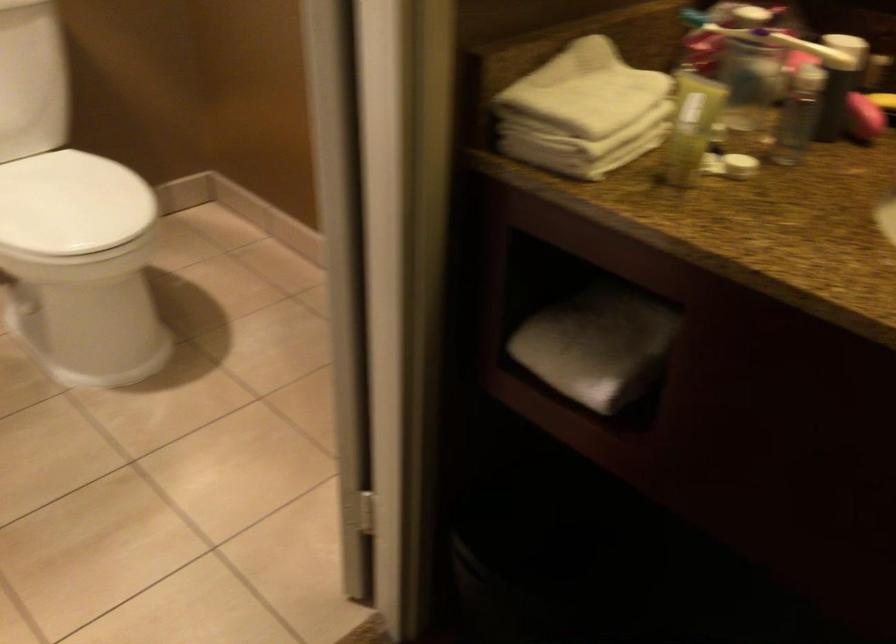
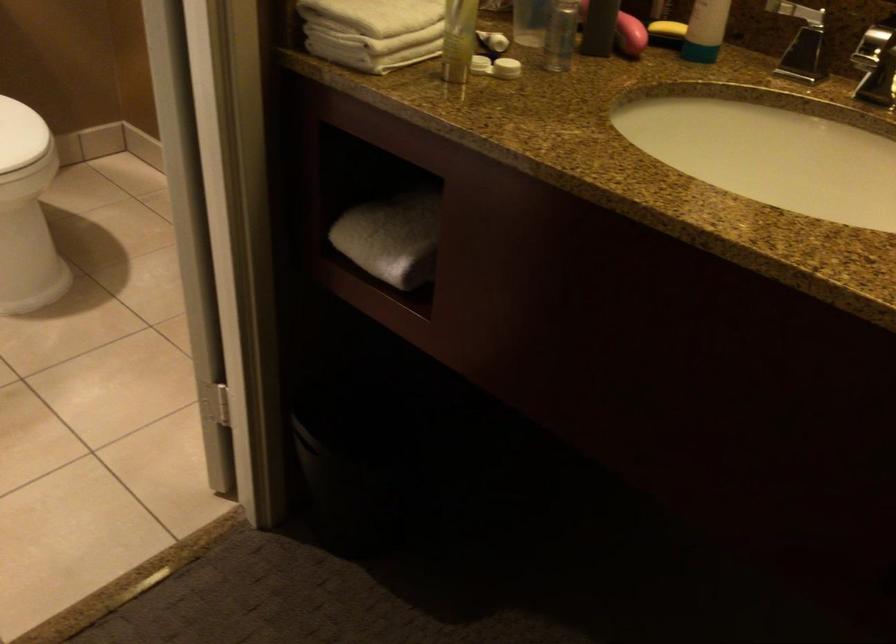
Where in the second image is the point corresponding to (707,162) from the first image?

(479, 64)